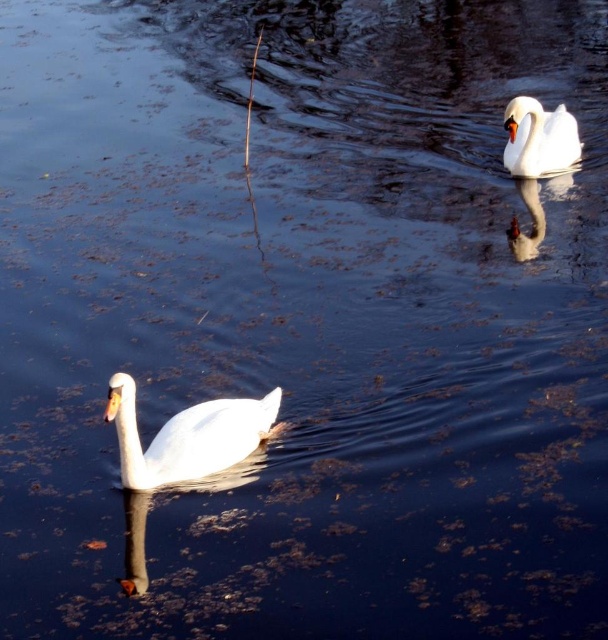
Question: Among these objects, which one is farthest from the camera?

Choices:
 (A) white glossy swan at lower left
 (B) white glossy swan at upper right

Answer: (B)

Question: Which point appears farthest from the camera in this image?

Choices:
 (A) (226, 424)
 (B) (572, 140)

Answer: (B)

Question: Is white glossy swan at lower left smaller than white glossy swan at upper right?

Choices:
 (A) yes
 (B) no

Answer: (A)

Question: Is the position of white glossy swan at lower left more distant than that of white glossy swan at upper right?

Choices:
 (A) yes
 (B) no

Answer: (B)

Question: Which of the following is the closest to the observer?

Choices:
 (A) white glossy swan at upper right
 (B) white glossy swan at lower left

Answer: (B)

Question: Observing the image, what is the correct spatial positioning of white glossy swan at lower left in reference to white glossy swan at upper right?

Choices:
 (A) right
 (B) left

Answer: (B)